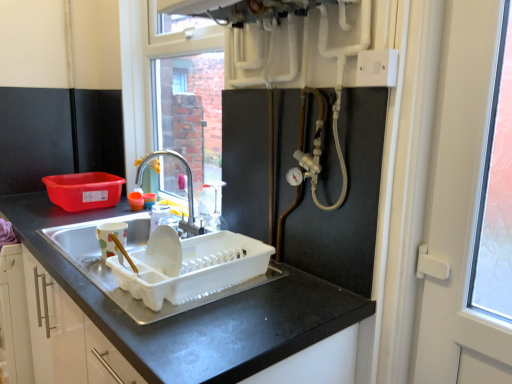
You are a GUI agent. You are given a task and a screenshot of the screen. Output one action in this format:
    pyautogui.click(x=<x>, y=<y>)
    Task: Click on the vacant area that is in front of matte ceramic mug at left, arranged as the first appliance when viewed from the left
    
    Given the screenshot: What is the action you would take?
    pyautogui.click(x=88, y=273)